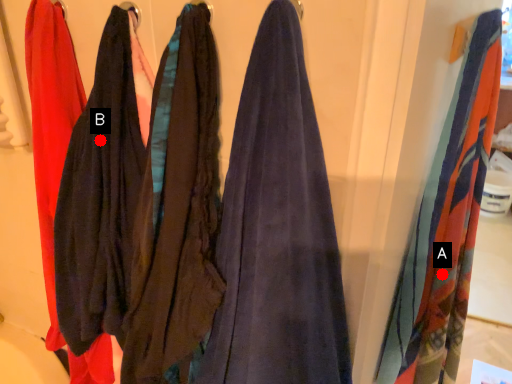
Question: Two points are circled on the image, labeled by A and B beside each circle. Which point is closer to the camera?

Choices:
 (A) A is closer
 (B) B is closer

Answer: (B)